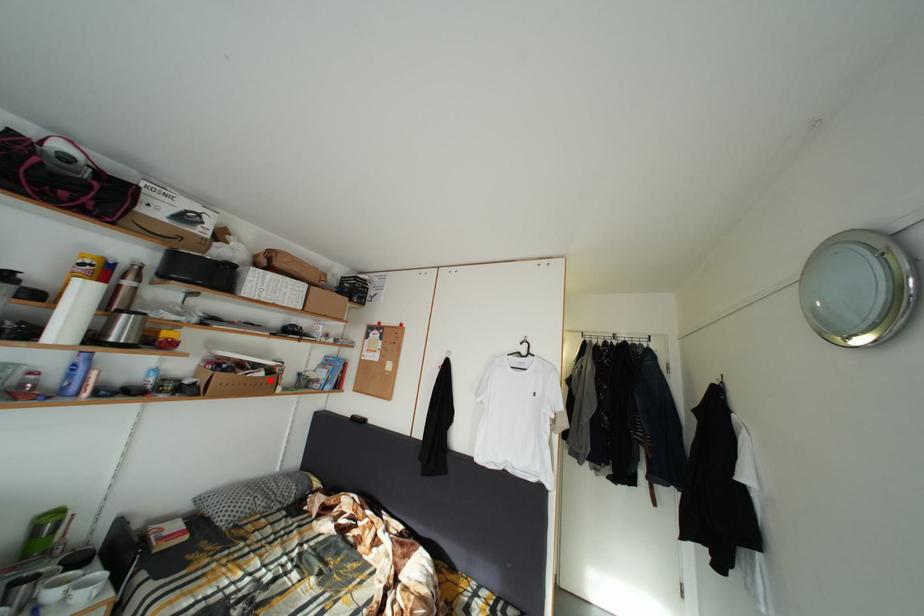
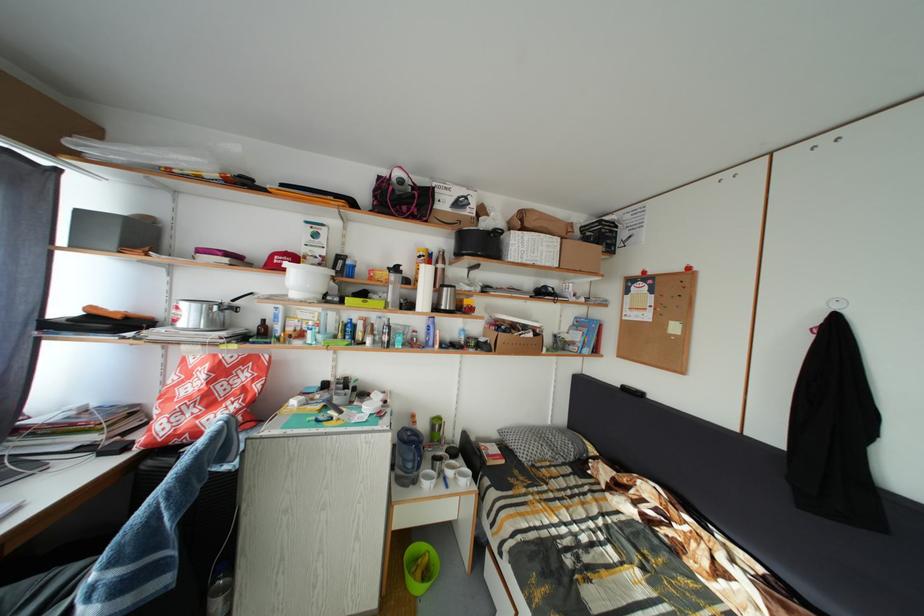
Find the pixel in the second image that matches the highlighted location in the first image.

(540, 341)